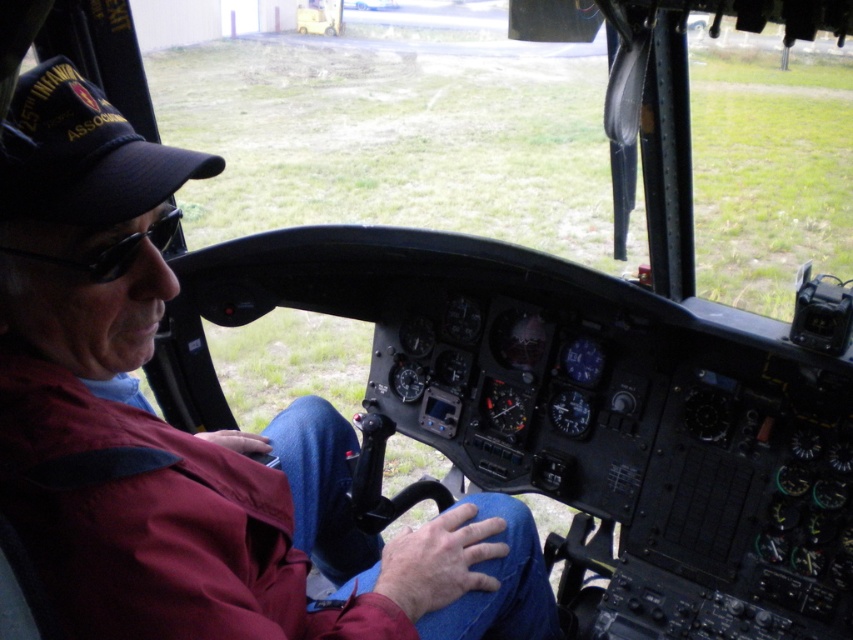
You are a passenger in the helicopter cockpit and want to locate the black fabric cap at upper left. Based on the cockpit layout, where is the point with coordinates (83, 154) located?

The point with coordinates (83, 154) corresponds to the black fabric cap at upper left.

You are sitting in the passenger seat of the helicopter cockpit. You need to locate the black fabric cap at upper left. According to the cockpit layout, where exactly is it positioned?

The black fabric cap at upper left is positioned at coordinates point (83, 154).

You are a passenger in a helicopter cockpit and want to reach a control located at point [3,172]. Your arm can extend 28 inches. Can you reach it?

The distance of point [3,172] from camera is 29.25 inches. Since your arm can only extend 28 inches, you cannot reach it.